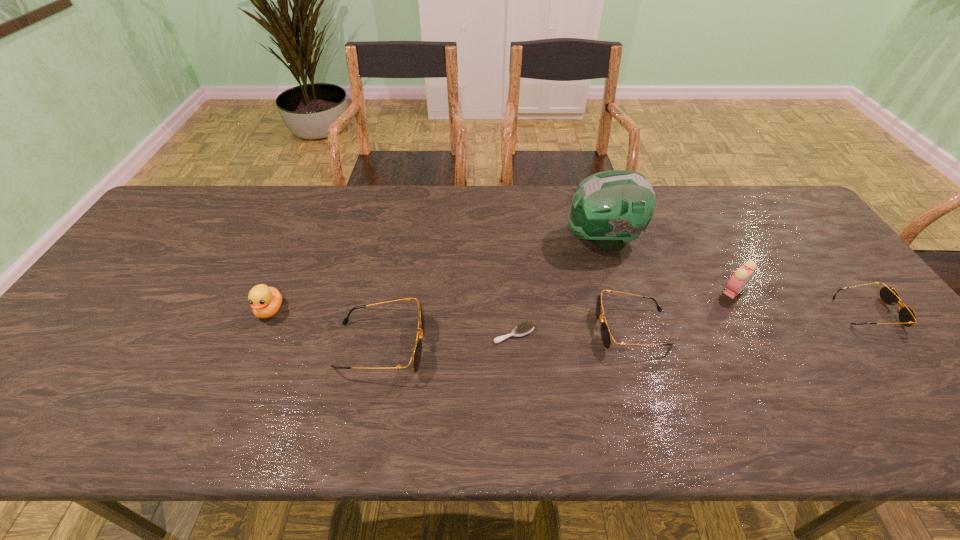
Identify the location of the tallest sunglasses. (416, 355).

At what (x,y) coordinates should I click in order to perform the action: click on the leftmost sunglasses. Please return your answer as a coordinate pair (x, y). The width and height of the screenshot is (960, 540). Looking at the image, I should click on (416, 355).

Find the location of `the second sunglasses from right to left`. the second sunglasses from right to left is located at coordinates (606, 336).

Where is `the third shortest object`? The height and width of the screenshot is (540, 960). the third shortest object is located at coordinates (606, 336).

Locate an element on the screen. the sixth tallest object is located at coordinates (907, 317).

I want to click on the rightmost sunglasses, so click(907, 317).

In order to click on the tallest object in this screenshot , I will do `click(611, 208)`.

This screenshot has width=960, height=540. Find the location of `football helmet`. football helmet is located at coordinates click(x=611, y=208).

Image resolution: width=960 pixels, height=540 pixels. I want to click on the leftmost object, so click(x=265, y=301).

You are a GUI agent. You are given a task and a screenshot of the screen. Output one action in this format:
    pyautogui.click(x=<x>, y=<y>)
    Task: Click on the alarm clock
    The height and width of the screenshot is (540, 960).
    Given the screenshot: What is the action you would take?
    pyautogui.click(x=741, y=277)